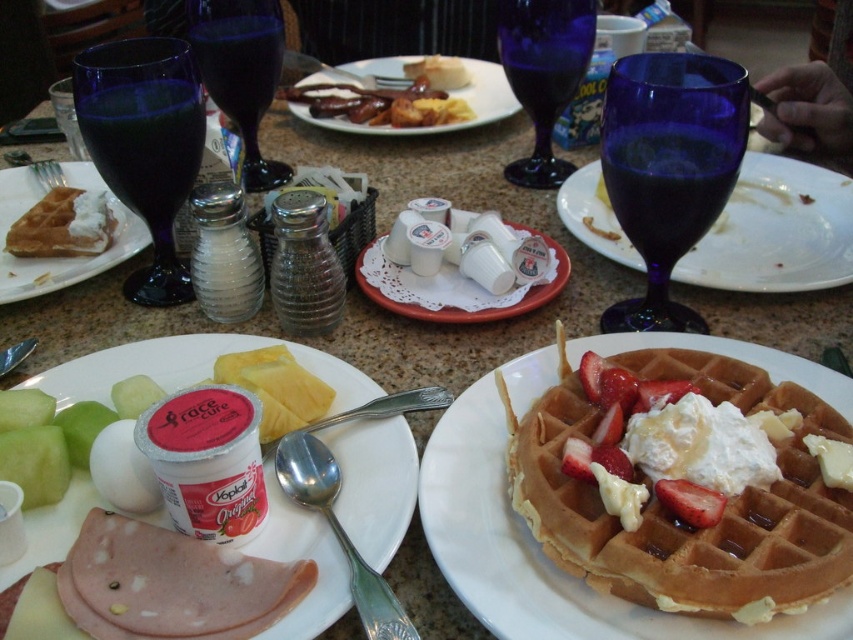
You are a customer at the restaurant and want to reach both the golden brown waffle with cream and strawberries at center and the matte glass plate at center. Which object is closer to you?

The golden brown waffle with cream and strawberries at center is closer to you because it is positioned below the matte glass plate at center, meaning the waffle is lower and thus nearer in this arrangement.